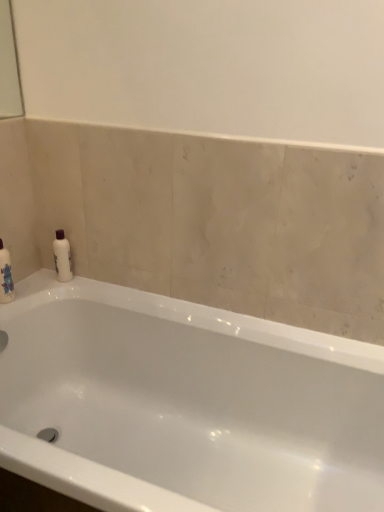
Question: From a real-world perspective, is white glossy bathtub at center physically located above or below white glossy bottle at upper left?

Choices:
 (A) above
 (B) below

Answer: (B)

Question: Considering the positions of white glossy bathtub at center and white glossy bottle at upper left in the image, is white glossy bathtub at center taller or shorter than white glossy bottle at upper left?

Choices:
 (A) tall
 (B) short

Answer: (A)

Question: Does point (322, 428) appear closer or farther from the camera than point (64, 266)?

Choices:
 (A) farther
 (B) closer

Answer: (B)

Question: Considering the positions of point (54, 261) and point (289, 487), is point (54, 261) closer or farther from the camera than point (289, 487)?

Choices:
 (A) farther
 (B) closer

Answer: (A)

Question: Based on their positions, is white glossy bottle at upper left located to the left or right of white glossy bathtub at center?

Choices:
 (A) left
 (B) right

Answer: (A)

Question: Do you think white glossy bottle at upper left is within white glossy bathtub at center, or outside of it?

Choices:
 (A) inside
 (B) outside

Answer: (B)

Question: From a real-world perspective, relative to white glossy bathtub at center, is white glossy bottle at upper left vertically above or below?

Choices:
 (A) above
 (B) below

Answer: (A)